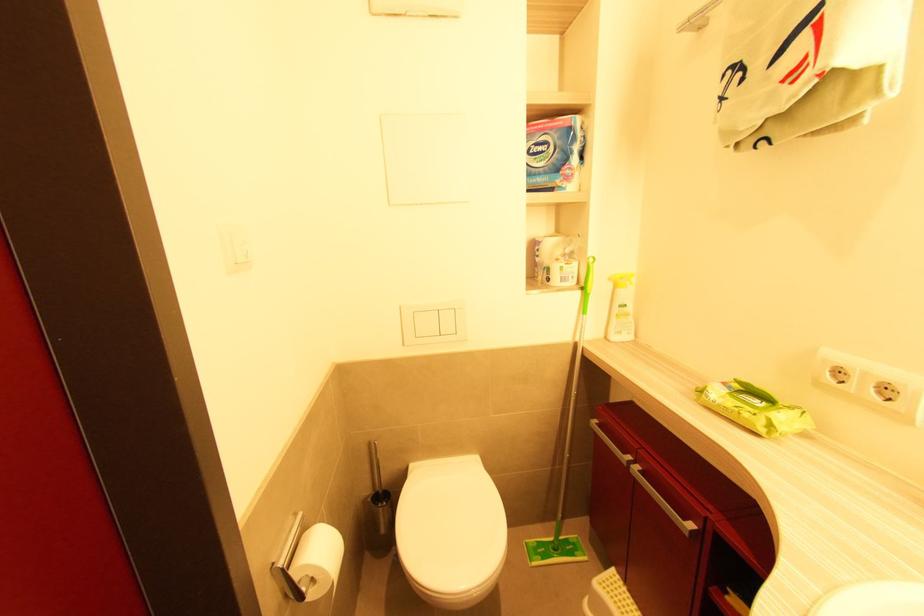
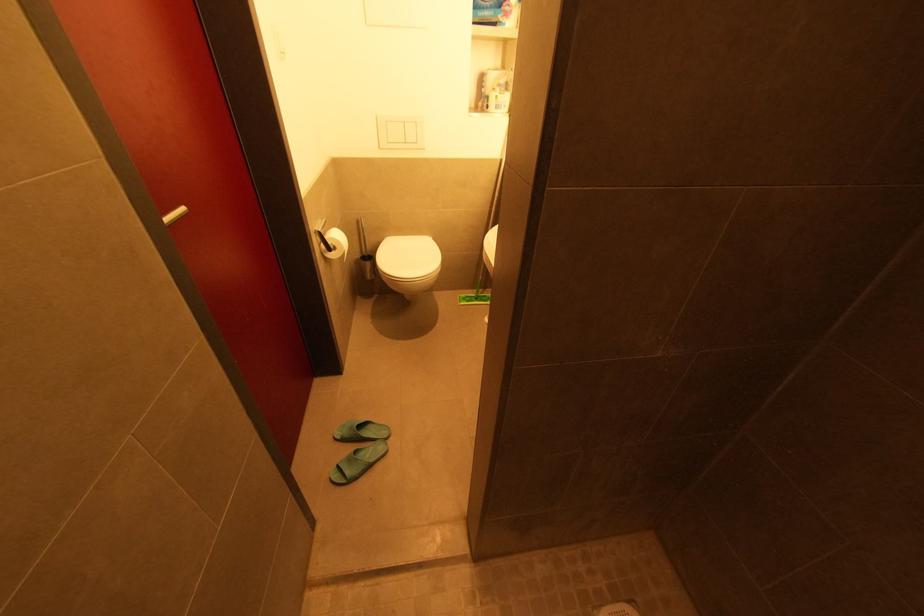
Question: The first image is from the beginning of the video and the second image is from the end. How did the camera likely rotate when shooting the video?

Choices:
 (A) Left
 (B) Right
 (C) Up
 (D) Down

Answer: (D)